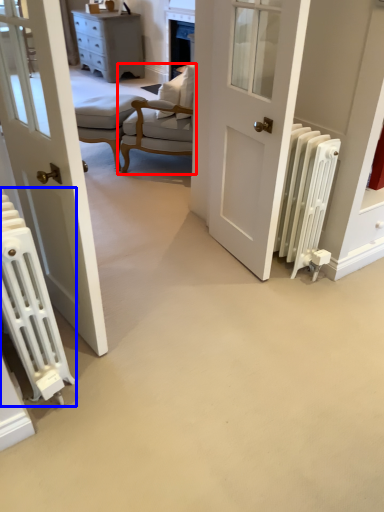
Question: Which point is further to the camera, chair (highlighted by a red box) or radiator (highlighted by a blue box)?

Choices:
 (A) chair
 (B) radiator

Answer: (A)